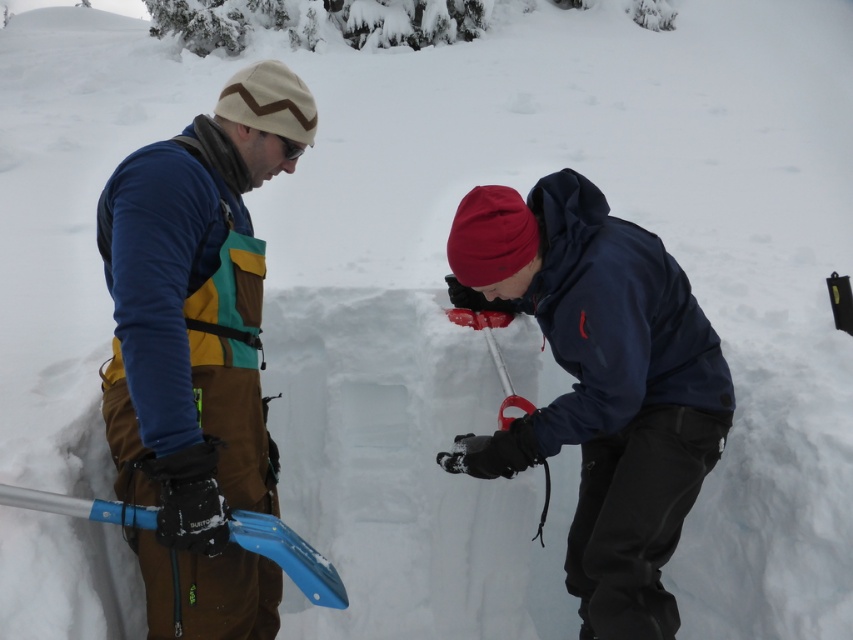
Does matte blue snow shovel at left have a smaller size compared to blue plastic shovel at lower left?

Incorrect, matte blue snow shovel at left is not smaller in size than blue plastic shovel at lower left.

Does point (270, 160) come farther from viewer compared to point (109, 516)?

That is True.

Locate an element on the screen. Image resolution: width=853 pixels, height=640 pixels. matte blue snow shovel at left is located at coordinates (196, 352).

Is point (647, 442) more distant than point (9, 490)?

Yes, it is.

Is dark blue jacket at center positioned before blue plastic shovel at lower left?

That is False.

The image size is (853, 640). I want to click on dark blue jacket at center, so click(601, 384).

Does matte blue snow shovel at left appear under dark blue jacket at center?

Actually, matte blue snow shovel at left is above dark blue jacket at center.

Is matte blue snow shovel at left smaller than dark blue jacket at center?

Yes, matte blue snow shovel at left is smaller than dark blue jacket at center.

Is point (233, 266) positioned in front of point (688, 401)?

Yes, point (233, 266) is closer to viewer.

Locate an element on the screen. This screenshot has width=853, height=640. matte blue snow shovel at left is located at coordinates (196, 352).